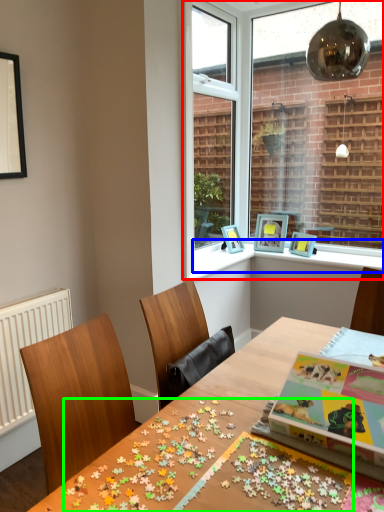
Question: Estimate the real-world distances between objects in this image. Which object is closer to window (highlighted by a red box), window sill (highlighted by a blue box) or board game (highlighted by a green box)?

Choices:
 (A) window sill
 (B) board game

Answer: (A)